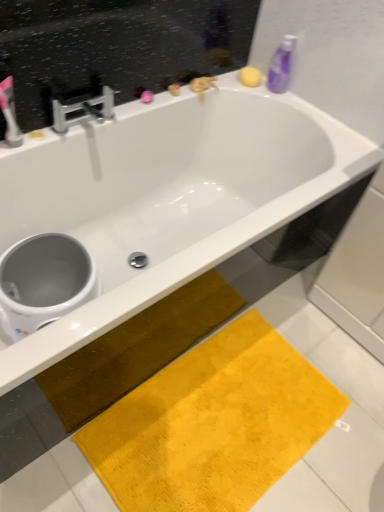
The width and height of the screenshot is (384, 512). Describe the element at coordinates (168, 196) in the screenshot. I see `white glossy bathtub at upper center` at that location.

Describe the element at coordinates (10, 113) in the screenshot. I see `matte white toothbrush at upper left` at that location.

The image size is (384, 512). In order to click on purple plastic bottle at upper right in this screenshot , I will do `click(281, 65)`.

Describe the element at coordinates (44, 281) in the screenshot. The image size is (384, 512). I see `white glossy toilet bowl at lower left` at that location.

This screenshot has height=512, width=384. What do you see at coordinates (83, 109) in the screenshot? I see `chrome metallic faucet at upper left` at bounding box center [83, 109].

At what (x,y) coordinates should I click in order to perform the action: click on white glossy bathtub at upper center. Please return your answer as a coordinate pair (x, y). Looking at the image, I should click on (168, 196).

Considering the relative positions of yellow plush bath mat at lower center and chrome metallic faucet at upper left in the image provided, is yellow plush bath mat at lower center behind chrome metallic faucet at upper left?

No, yellow plush bath mat at lower center is closer to the camera.

From the image's perspective, which one is positioned higher, yellow plush bath mat at lower center or chrome metallic faucet at upper left?

chrome metallic faucet at upper left appears higher in the image.

You are a GUI agent. You are given a task and a screenshot of the screen. Output one action in this format:
    pyautogui.click(x=<x>, y=<y>)
    Task: Click on the tap behind the yellow plush bath mat at lower center
    Image resolution: width=384 pixels, height=512 pixels.
    Given the screenshot: What is the action you would take?
    pyautogui.click(x=83, y=109)

Considering the relative sizes of matte white toothbrush at upper left and white glossy toilet bowl at lower left in the image provided, is matte white toothbrush at upper left wider than white glossy toilet bowl at lower left?

No, matte white toothbrush at upper left is not wider than white glossy toilet bowl at lower left.

Considering the sizes of objects matte white toothbrush at upper left and white glossy toilet bowl at lower left in the image provided, who is smaller, matte white toothbrush at upper left or white glossy toilet bowl at lower left?

matte white toothbrush at upper left.

From a real-world perspective, does matte white toothbrush at upper left sit lower than white glossy toilet bowl at lower left?

No, from a real-world perspective, matte white toothbrush at upper left is not under white glossy toilet bowl at lower left.

Which is behind, matte white toothbrush at upper left or chrome metallic faucet at upper left?

chrome metallic faucet at upper left is further away from the camera.

Considering the relative sizes of matte white toothbrush at upper left and chrome metallic faucet at upper left in the image provided, is matte white toothbrush at upper left wider than chrome metallic faucet at upper left?

Incorrect, the width of matte white toothbrush at upper left does not surpass that of chrome metallic faucet at upper left.

In the scene shown: Is the surface of matte white toothbrush at upper left in direct contact with chrome metallic faucet at upper left?

No, matte white toothbrush at upper left is not making contact with chrome metallic faucet at upper left.

Considering the sizes of objects matte white toothbrush at upper left and chrome metallic faucet at upper left in the image provided, who is taller, matte white toothbrush at upper left or chrome metallic faucet at upper left?

matte white toothbrush at upper left is taller.

Measure the distance from purple plastic bottle at upper right to chrome metallic faucet at upper left.

The distance of purple plastic bottle at upper right from chrome metallic faucet at upper left is 29.67 inches.

Is chrome metallic faucet at upper left at the back of purple plastic bottle at upper right?

purple plastic bottle at upper right is not turned away from chrome metallic faucet at upper left.

From the picture: Is purple plastic bottle at upper right positioned beyond the bounds of chrome metallic faucet at upper left?

purple plastic bottle at upper right is positioned outside chrome metallic faucet at upper left.

Based on their positions, is purple plastic bottle at upper right located to the left or right of chrome metallic faucet at upper left?

Clearly, purple plastic bottle at upper right is on the right of chrome metallic faucet at upper left in the image.

How much distance is there between purple plastic bottle at upper right and matte white toothbrush at upper left?

purple plastic bottle at upper right is 3.38 feet from matte white toothbrush at upper left.

Is point (284, 35) less distant than point (13, 93)?

No, (284, 35) is behind (13, 93).

Is purple plastic bottle at upper right aimed at matte white toothbrush at upper left?

Yes, purple plastic bottle at upper right is oriented towards matte white toothbrush at upper left.

Could you tell me if white glossy toilet bowl at lower left is turned towards chrome metallic faucet at upper left?

No, white glossy toilet bowl at lower left is not oriented towards chrome metallic faucet at upper left.

Which of these two, white glossy toilet bowl at lower left or chrome metallic faucet at upper left, is smaller?

With smaller size is chrome metallic faucet at upper left.

Does white glossy toilet bowl at lower left have a lesser width compared to chrome metallic faucet at upper left?

Incorrect, the width of white glossy toilet bowl at lower left is not less than that of chrome metallic faucet at upper left.

From a real-world perspective, who is located higher, white glossy toilet bowl at lower left or chrome metallic faucet at upper left?

In real-world perspective, chrome metallic faucet at upper left is above.

From a real-world perspective, is matte white toothbrush at upper left on yellow plush bath mat at lower center?

Yes, from a real-world perspective, matte white toothbrush at upper left is over yellow plush bath mat at lower center

Considering the sizes of matte white toothbrush at upper left and yellow plush bath mat at lower center in the image, is matte white toothbrush at upper left bigger or smaller than yellow plush bath mat at lower center?

Considering their sizes, matte white toothbrush at upper left takes up less space than yellow plush bath mat at lower center.

Considering the relative sizes of matte white toothbrush at upper left and yellow plush bath mat at lower center in the image provided, is matte white toothbrush at upper left taller than yellow plush bath mat at lower center?

Correct, matte white toothbrush at upper left is much taller as yellow plush bath mat at lower center.

Is yellow plush bath mat at lower center surrounded by matte white toothbrush at upper left?

No.

Image resolution: width=384 pixels, height=512 pixels. I want to click on beach towel directly beneath the chrome metallic faucet at upper left (from a real-world perspective), so click(x=213, y=424).

This screenshot has height=512, width=384. What are the coordinates of `toilet bowl on the right of matte white toothbrush at upper left` in the screenshot? It's located at (44, 281).

Based on their spatial positions, is yellow plush bath mat at lower center or matte white toothbrush at upper left further from chrome metallic faucet at upper left?

Based on the image, yellow plush bath mat at lower center appears to be further to chrome metallic faucet at upper left.

From the image, which object appears to be nearer to white glossy toilet bowl at lower left, matte white toothbrush at upper left or yellow plush bath mat at lower center?

The object closer to white glossy toilet bowl at lower left is matte white toothbrush at upper left.

From the image, which object appears to be farther from white glossy toilet bowl at lower left, yellow plush bath mat at lower center or purple plastic bottle at upper right?

The object further to white glossy toilet bowl at lower left is purple plastic bottle at upper right.

Estimate the real-world distances between objects in this image. Which object is closer to chrome metallic faucet at upper left, white glossy bathtub at upper center or yellow plush bath mat at lower center?

white glossy bathtub at upper center is positioned closer to the anchor chrome metallic faucet at upper left.

Which object lies nearer to the anchor point purple plastic bottle at upper right, white glossy toilet bowl at lower left or white glossy bathtub at upper center?

white glossy bathtub at upper center.

Looking at the image, which one is located closer to white glossy bathtub at upper center, chrome metallic faucet at upper left or white glossy toilet bowl at lower left?

white glossy toilet bowl at lower left lies closer to white glossy bathtub at upper center than the other object.

From the picture: Estimate the real-world distances between objects in this image. Which object is closer to yellow plush bath mat at lower center, purple plastic bottle at upper right or matte white toothbrush at upper left?

matte white toothbrush at upper left is positioned closer to the anchor yellow plush bath mat at lower center.

Estimate the real-world distances between objects in this image. Which object is further from matte white toothbrush at upper left, yellow plush bath mat at lower center or purple plastic bottle at upper right?

yellow plush bath mat at lower center lies further to matte white toothbrush at upper left than the other object.

Locate an element on the screen. This screenshot has height=512, width=384. bathtub between purple plastic bottle at upper right and yellow plush bath mat at lower center in the vertical direction is located at coordinates (168, 196).

Locate an element on the screen. Image resolution: width=384 pixels, height=512 pixels. toothbrush that lies between purple plastic bottle at upper right and yellow plush bath mat at lower center from top to bottom is located at coordinates (10, 113).

Locate an element on the screen. The width and height of the screenshot is (384, 512). toilet bowl between chrome metallic faucet at upper left and yellow plush bath mat at lower center in the vertical direction is located at coordinates (44, 281).

Locate an element on the screen. This screenshot has height=512, width=384. bathtub that lies between matte white toothbrush at upper left and yellow plush bath mat at lower center from top to bottom is located at coordinates (x=168, y=196).